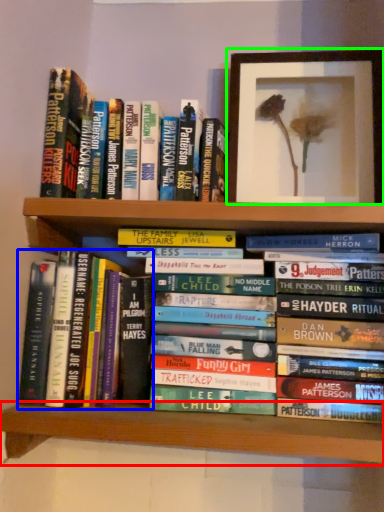
Question: Estimate the real-world distances between objects in this image. Which object is farther from shelf (highlighted by a red box), book (highlighted by a blue box) or picture frame (highlighted by a green box)?

Choices:
 (A) book
 (B) picture frame

Answer: (B)